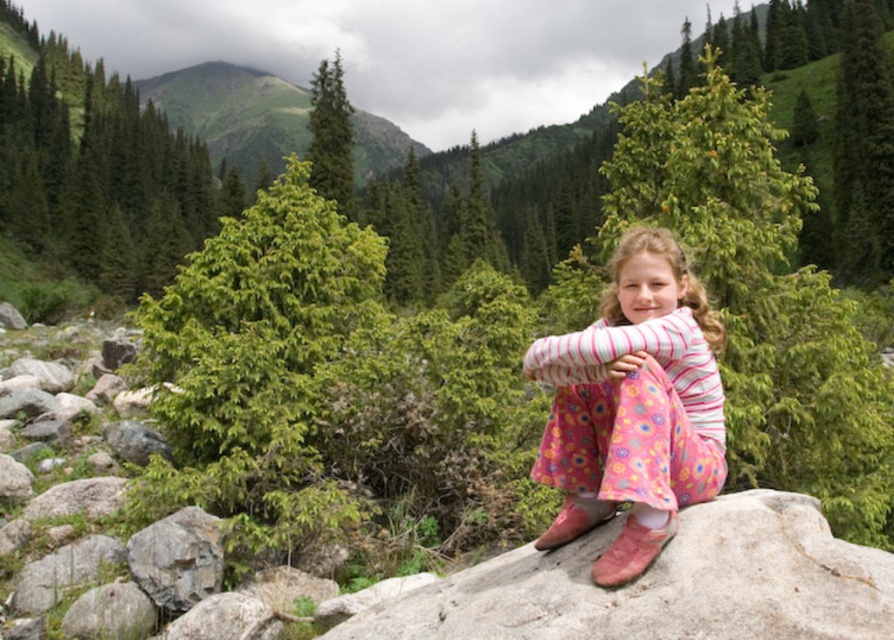
In the scene shown: Between pink floral dress at center and matte brown boot at lower center, which one appears on the left side from the viewer's perspective?

From the viewer's perspective, matte brown boot at lower center appears more on the left side.

Between point (654, 278) and point (564, 525), which one is positioned behind?

The point (564, 525) is more distant.

Between point (562, 358) and point (572, 525), which one is positioned in front?

Point (562, 358) is in front.

What are the coordinates of `pink floral dress at center` in the screenshot? It's located at [x=633, y=406].

Is the position of green grassy mountain at upper center more distant than that of green matte pine at upper center?

That is True.

Who is more forward, (137,90) or (347,156)?

Point (347,156)

Locate an element on the screen. green grassy mountain at upper center is located at coordinates (234, 113).

Does green matte pine at upper center lie in front of matte brown boot at lower center?

No, green matte pine at upper center is further to the viewer.

Between point (344, 104) and point (566, 531), which one is positioned in front?

Point (566, 531) is more forward.

This screenshot has width=894, height=640. Find the location of `green matte pine at upper center`. green matte pine at upper center is located at coordinates (330, 136).

At what (x,y) coordinates should I click in order to perform the action: click on green matte pine at upper center. Please return your answer as a coordinate pair (x, y). The height and width of the screenshot is (640, 894). Looking at the image, I should click on (330, 136).